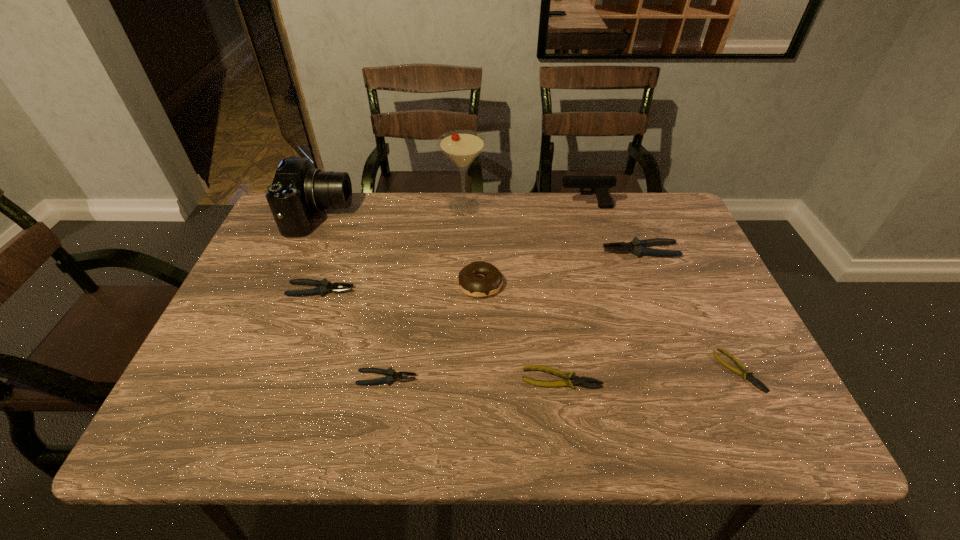
This screenshot has height=540, width=960. In order to click on pistol at the far edge in this screenshot , I will do point(600,185).

Locate an element on the screen. The height and width of the screenshot is (540, 960). camera located in the left edge section of the desktop is located at coordinates (298, 190).

You are a GUI agent. You are given a task and a screenshot of the screen. Output one action in this format:
    pyautogui.click(x=<x>, y=<y>)
    Task: Click on the pliers that is at the left edge
    
    Given the screenshot: What is the action you would take?
    pyautogui.click(x=323, y=286)

Find the location of a particular element. This screenshot has width=960, height=540. object present at the far left corner is located at coordinates (298, 190).

Image resolution: width=960 pixels, height=540 pixels. What are the coordinates of `vacant space at the far edge` in the screenshot? It's located at (614, 211).

This screenshot has height=540, width=960. Find the location of `vacant space at the near edge`. vacant space at the near edge is located at coordinates (575, 434).

Locate an element on the screen. This screenshot has height=540, width=960. blank space at the right edge of the desktop is located at coordinates (709, 293).

Where is `free spot at the near right corner of the desktop`? The image size is (960, 540). free spot at the near right corner of the desktop is located at coordinates (767, 409).

Where is `free space between the farthest gray pliers and the fourth tallest pliers`? Image resolution: width=960 pixels, height=540 pixels. free space between the farthest gray pliers and the fourth tallest pliers is located at coordinates (601, 315).

Locate an element on the screen. The height and width of the screenshot is (540, 960). free space that is in between the second tallest object and the second tallest pliers is located at coordinates (321, 253).